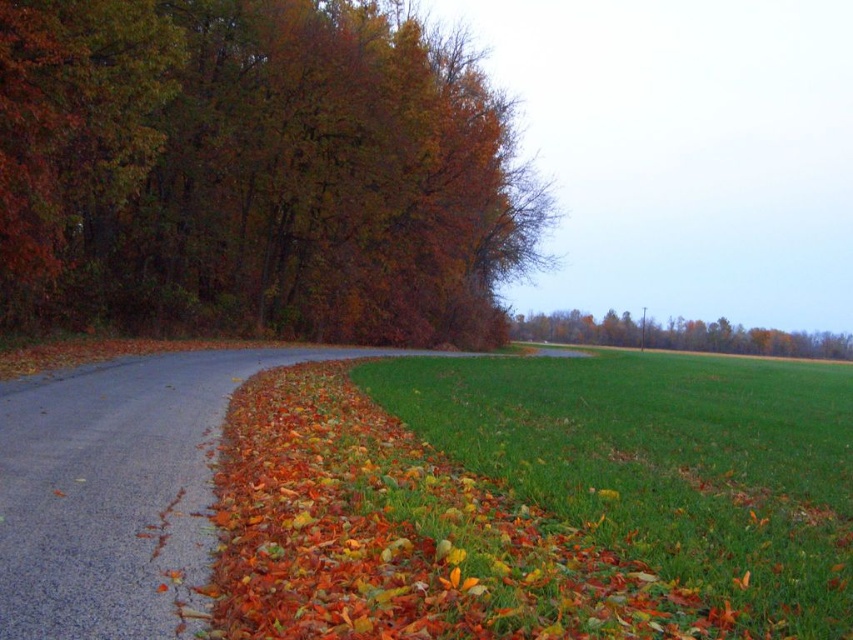
Question: From the image, what is the correct spatial relationship of autumn leaves at left in relation to gray asphalt road at lower left?

Choices:
 (A) below
 (B) above

Answer: (B)

Question: Does gray asphalt road at lower left appear on the left side of green leafy tree at center?

Choices:
 (A) no
 (B) yes

Answer: (B)

Question: Which object is the farthest from the green leafy tree at center?

Choices:
 (A) green grass at lower right
 (B) autumn leaves at left
 (C) gray asphalt road at lower left

Answer: (C)

Question: Which of the following is the closest to the observer?

Choices:
 (A) green leafy tree at center
 (B) gray asphalt road at lower left
 (C) autumn leaves at left
 (D) green grass at lower right

Answer: (B)

Question: Estimate the real-world distances between objects in this image. Which object is farther from the green grass at lower right?

Choices:
 (A) autumn leaves at left
 (B) gray asphalt road at lower left
 (C) green leafy tree at center

Answer: (C)

Question: Can you confirm if autumn leaves at left is positioned to the left of gray asphalt road at lower left?

Choices:
 (A) no
 (B) yes

Answer: (A)